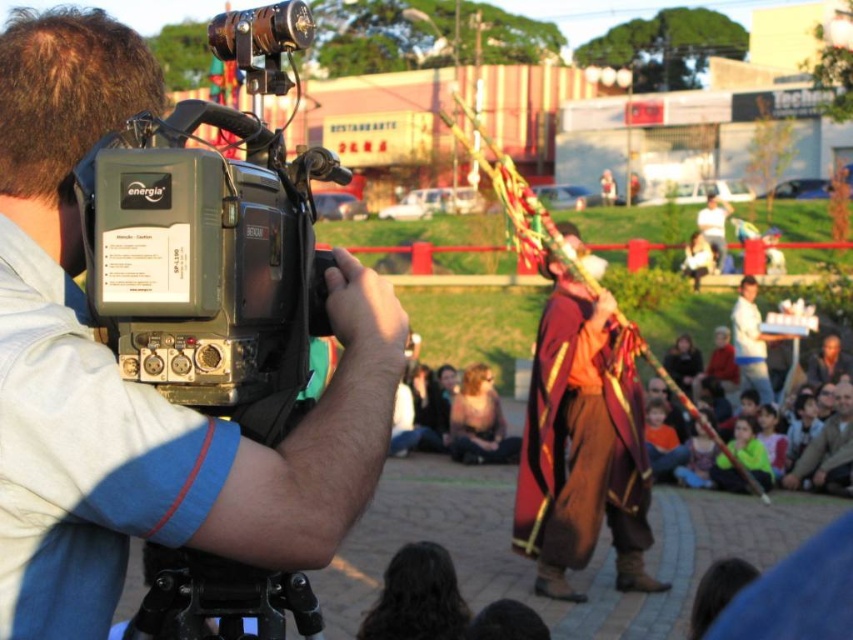
You are a photographer trying to capture a photo of the velvet maroon cape at center. The black plastic camera at left is the only one available. Is the camera tall enough to frame the cape properly?

The black plastic camera at left is shorter than velvet maroon cape at center, so it may not be tall enough to frame the cape properly without adjusting the angle or position.

You are a photographer trying to decide which object to focus on in the scene. The black plastic camera at left and the velvet maroon cape at center are both in your view. Which object is narrower in width?

The black plastic camera at left is narrower in width than the velvet maroon cape at center.